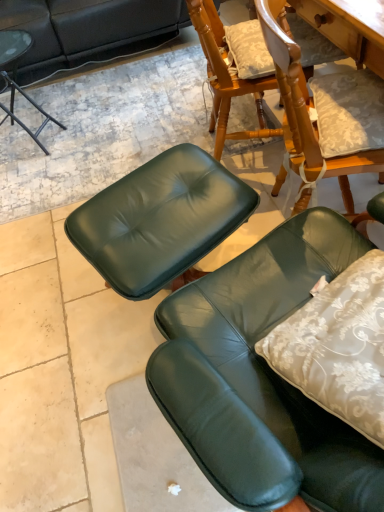
This screenshot has height=512, width=384. Identify the location of free space behind matte black side table at upper left, which is the 2th chair from bottom to top. (62, 92).